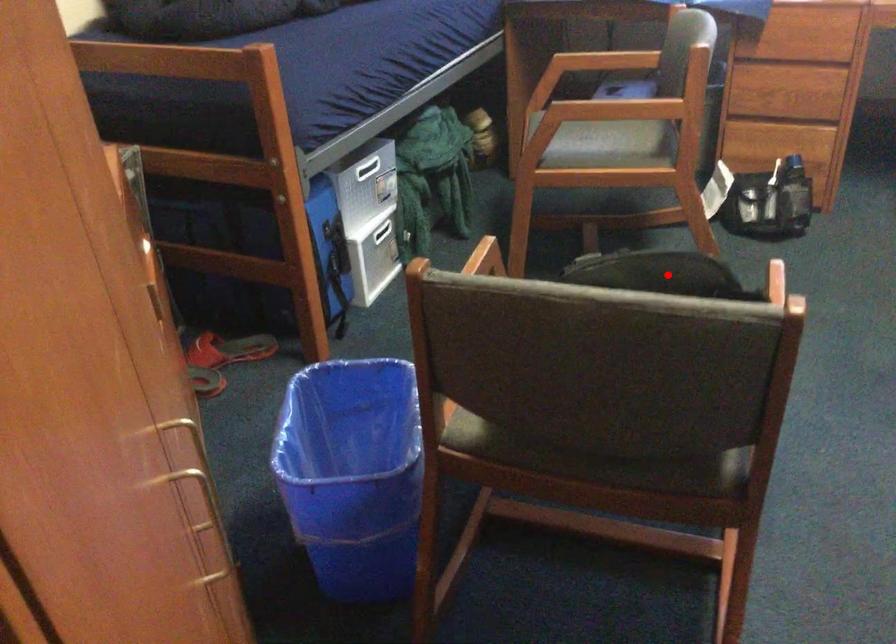
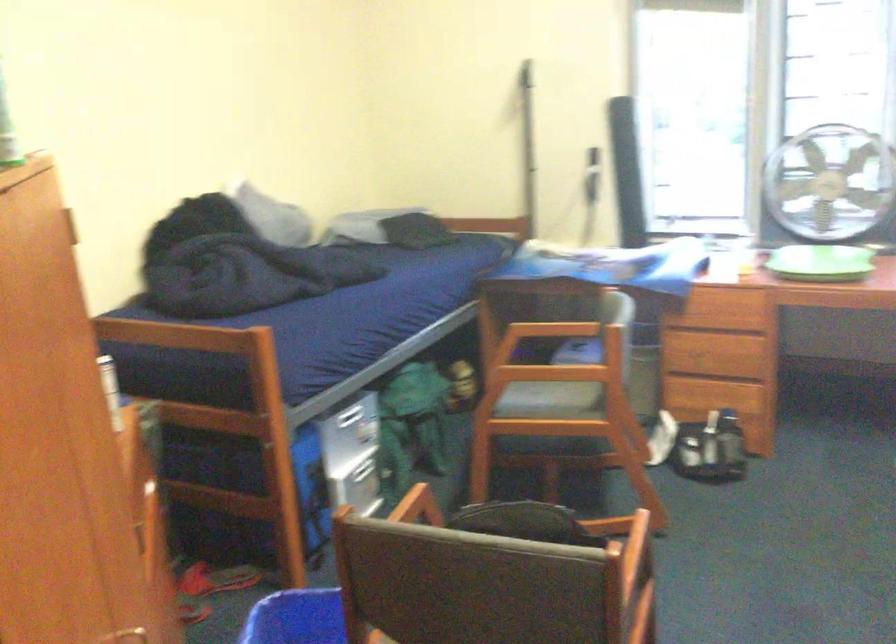
In the second image, find the point that corresponds to the highlighted location in the first image.

(528, 523)